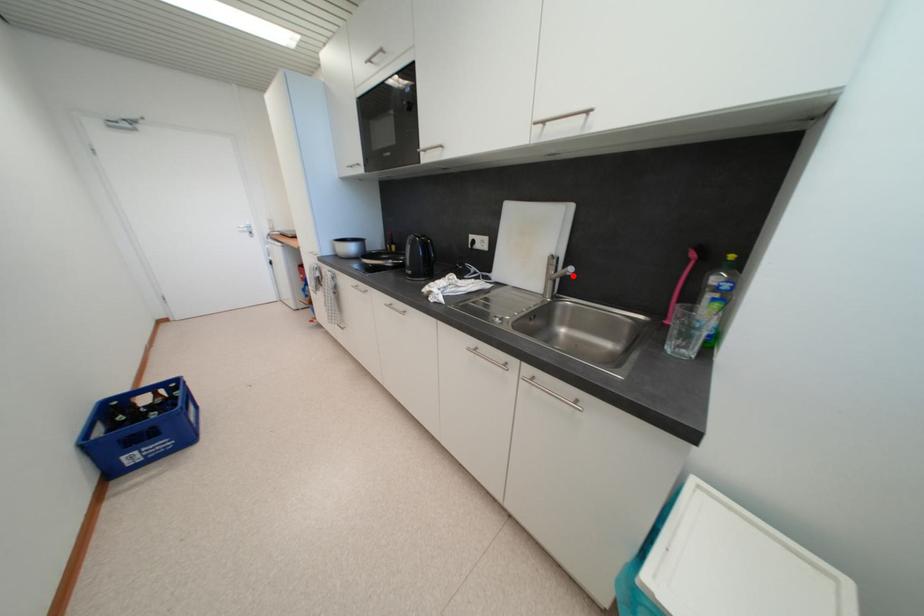
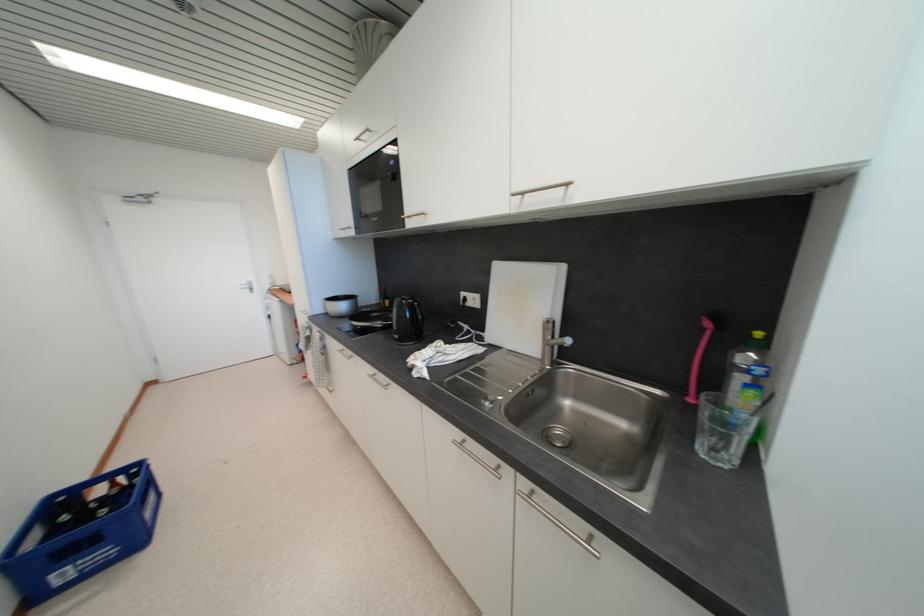
Where in the second image is the point corresponding to the highlighted location from the first image?

(570, 347)